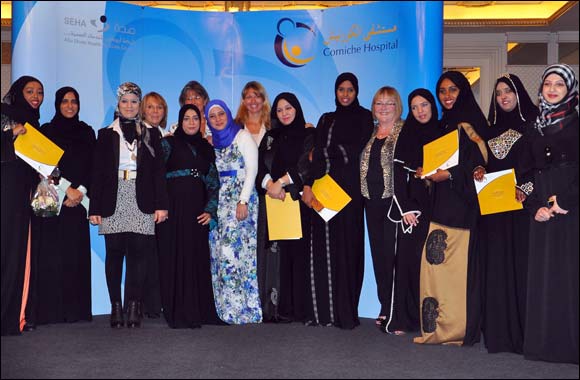
Identify the location of blue hanging banner. (219, 40).